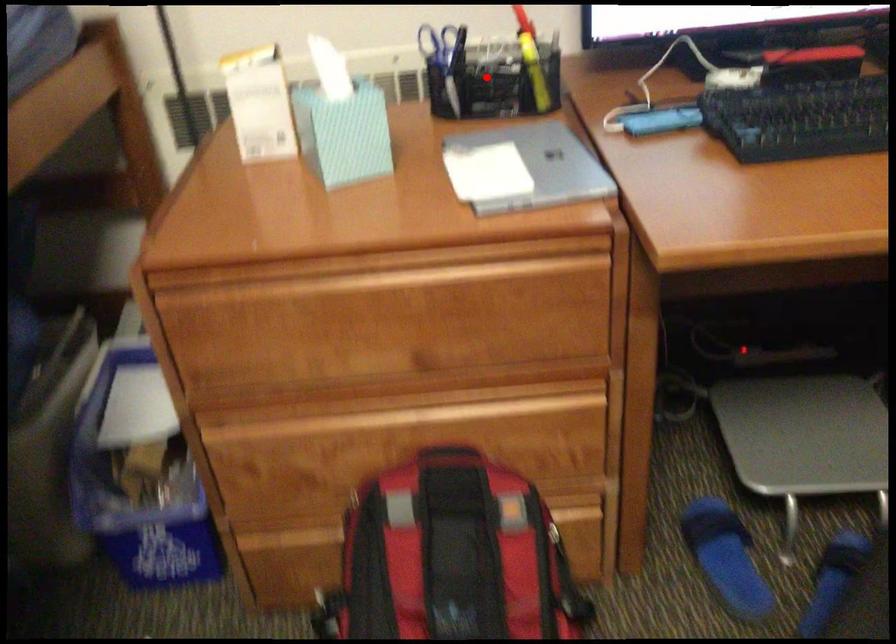
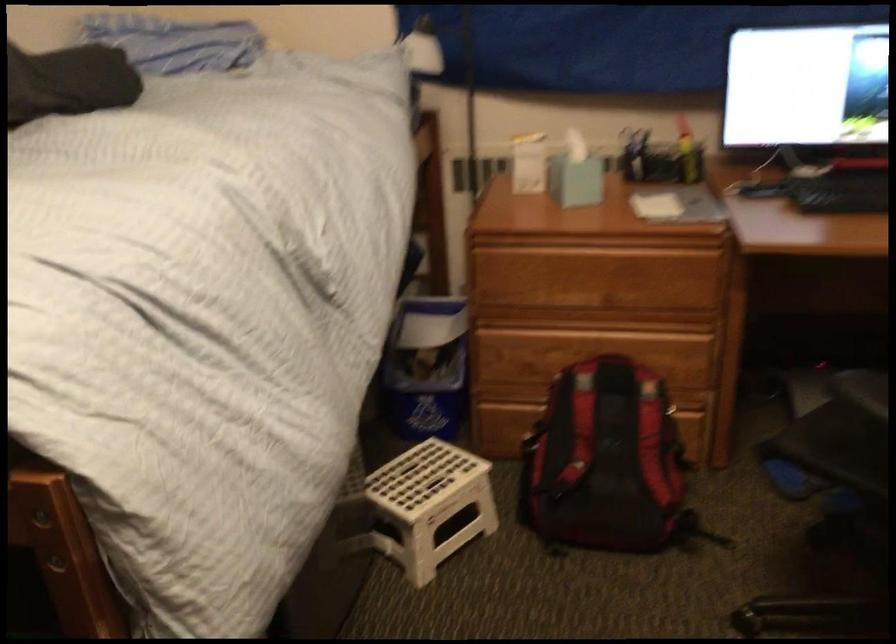
Locate, in the second image, the point that corresponds to the highlighted location in the first image.

(660, 158)